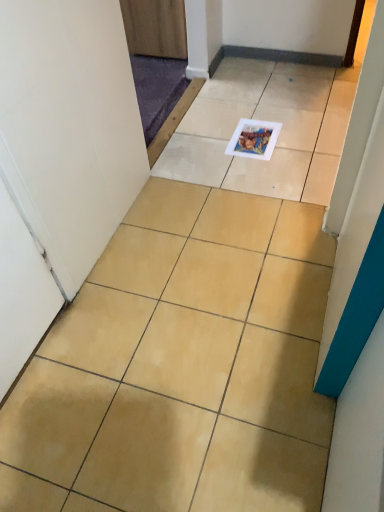
Measure the distance between point (184, 14) and camera.

Point (184, 14) is 7.15 feet away from camera.

What do you see at coordinates (182, 366) in the screenshot? I see `beige ceramic tile at center` at bounding box center [182, 366].

This screenshot has width=384, height=512. In order to click on beige ceramic tile at center in this screenshot , I will do `click(182, 366)`.

This screenshot has height=512, width=384. I want to click on wooden door at upper center, so click(x=155, y=27).

What's the angular difference between beige ceramic tile at center and wooden door at upper center's facing directions?

89.3 degrees.

Which of these two, beige ceramic tile at center or wooden door at upper center, is bigger?

Bigger between the two is wooden door at upper center.

From the picture: Is beige ceramic tile at center facing away from wooden door at upper center?

No, beige ceramic tile at center is not facing the opposite direction of wooden door at upper center.

Locate an element on the screen. This screenshot has width=384, height=512. ceramic tile that is on the right side of wooden door at upper center is located at coordinates (182, 366).

Considering the relative sizes of beige ceramic tile at center and matte plastic magazine at center in the image provided, is beige ceramic tile at center smaller than matte plastic magazine at center?

Incorrect, beige ceramic tile at center is not smaller in size than matte plastic magazine at center.

Does beige ceramic tile at center come behind matte plastic magazine at center?

No, beige ceramic tile at center is closer to the viewer.

Is beige ceramic tile at center taller or shorter than matte plastic magazine at center?

Considering their sizes, beige ceramic tile at center has more height than matte plastic magazine at center.

Does point (237, 242) appear closer or farther from the camera than point (254, 149)?

Point (237, 242) is positioned closer to the camera compared to point (254, 149).

Is there a large distance between matte plastic magazine at center and wooden door at upper center?

No, there isn't a large distance between matte plastic magazine at center and wooden door at upper center.

From the picture: Who is more distant, matte plastic magazine at center or wooden door at upper center?

wooden door at upper center.

Find the location of a particular element. The width and height of the screenshot is (384, 512). magazine in front of the wooden door at upper center is located at coordinates pos(254,139).

Which point is more distant from viewer, (x=262, y=150) or (x=133, y=11)?

The point (x=133, y=11) is behind.

The image size is (384, 512). What are the coordinates of `door above the matte plastic magazine at center (from the image's perspective)` in the screenshot? It's located at (155, 27).

From the image's perspective, relative to matte plastic magazine at center, is wooden door at upper center above or below?

wooden door at upper center is situated higher than matte plastic magazine at center in the image.

Is matte plastic magazine at center inside wooden door at upper center?

No, matte plastic magazine at center is not a part of wooden door at upper center.

Does wooden door at upper center have a larger size compared to matte plastic magazine at center?

Yes.

Which is more distant, [131,48] or [120,448]?

The point [131,48] is farther.

Is wooden door at upper center next to beige ceramic tile at center and touching it?

wooden door at upper center is not next to beige ceramic tile at center, and they're not touching.

Considering the relative positions of wooden door at upper center and beige ceramic tile at center in the image provided, is wooden door at upper center in front of beige ceramic tile at center?

No, wooden door at upper center is further to the viewer.

In terms of size, does wooden door at upper center appear bigger or smaller than beige ceramic tile at center?

In the image, wooden door at upper center appears to be larger than beige ceramic tile at center.

Is matte plastic magazine at center taller than beige ceramic tile at center?

Incorrect, the height of matte plastic magazine at center is not larger of that of beige ceramic tile at center.

Where is `magazine located above the beige ceramic tile at center (from a real-world perspective)`? magazine located above the beige ceramic tile at center (from a real-world perspective) is located at coordinates (254, 139).

Considering the relative positions of matte plastic magazine at center and beige ceramic tile at center in the image provided, is matte plastic magazine at center to the right of beige ceramic tile at center from the viewer's perspective?

Yes, matte plastic magazine at center is to the right of beige ceramic tile at center.

Who is more distant, matte plastic magazine at center or beige ceramic tile at center?

matte plastic magazine at center is further away from the camera.

Identify the location of door that is on the left side of beige ceramic tile at center. The image size is (384, 512). (155, 27).

Where is `magazine positioned vertically above the beige ceramic tile at center (from a real-world perspective)`? The width and height of the screenshot is (384, 512). magazine positioned vertically above the beige ceramic tile at center (from a real-world perspective) is located at coordinates (254, 139).

Considering their positions, is beige ceramic tile at center positioned further to matte plastic magazine at center than wooden door at upper center?

beige ceramic tile at center lies further to matte plastic magazine at center than the other object.

Looking at the image, which one is located further to beige ceramic tile at center, wooden door at upper center or matte plastic magazine at center?

The object further to beige ceramic tile at center is wooden door at upper center.

Looking at the image, which one is located further to wooden door at upper center, beige ceramic tile at center or matte plastic magazine at center?

beige ceramic tile at center lies further to wooden door at upper center than the other object.

Consider the image. Considering their positions, is matte plastic magazine at center positioned further to wooden door at upper center than beige ceramic tile at center?

beige ceramic tile at center is positioned further to the anchor wooden door at upper center.

From the picture: Which object lies nearer to the anchor point matte plastic magazine at center, wooden door at upper center or beige ceramic tile at center?

wooden door at upper center is positioned closer to the anchor matte plastic magazine at center.

When comparing their distances from beige ceramic tile at center, does matte plastic magazine at center or wooden door at upper center seem further?

wooden door at upper center is further to beige ceramic tile at center.

Where is `magazine between beige ceramic tile at center and wooden door at upper center along the z-axis`? magazine between beige ceramic tile at center and wooden door at upper center along the z-axis is located at coordinates (254, 139).